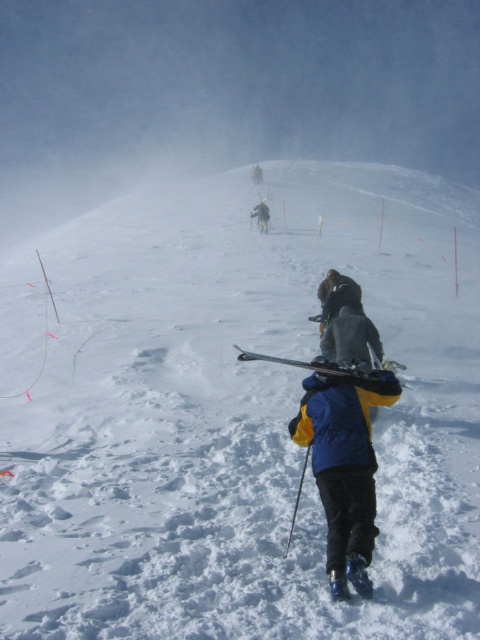
Question: Is the position of blue/yellow jacket at center less distant than that of shiny metallic ski at center?

Choices:
 (A) yes
 (B) no

Answer: (A)

Question: Observing the image, what is the correct spatial positioning of blue/yellow jacket at center in reference to shiny metallic ski at center?

Choices:
 (A) left
 (B) right

Answer: (B)

Question: Which point appears farthest from the camera in this image?

Choices:
 (A) (330, 472)
 (B) (259, 214)

Answer: (B)

Question: Which point appears closest to the camera in this image?

Choices:
 (A) (372, 371)
 (B) (264, 202)

Answer: (A)

Question: Which point appears farthest from the camera in this image?

Choices:
 (A) (263, 221)
 (B) (309, 406)

Answer: (A)

Question: Does blue/yellow jacket at center appear on the left side of shiny metallic ski at center?

Choices:
 (A) no
 (B) yes

Answer: (A)